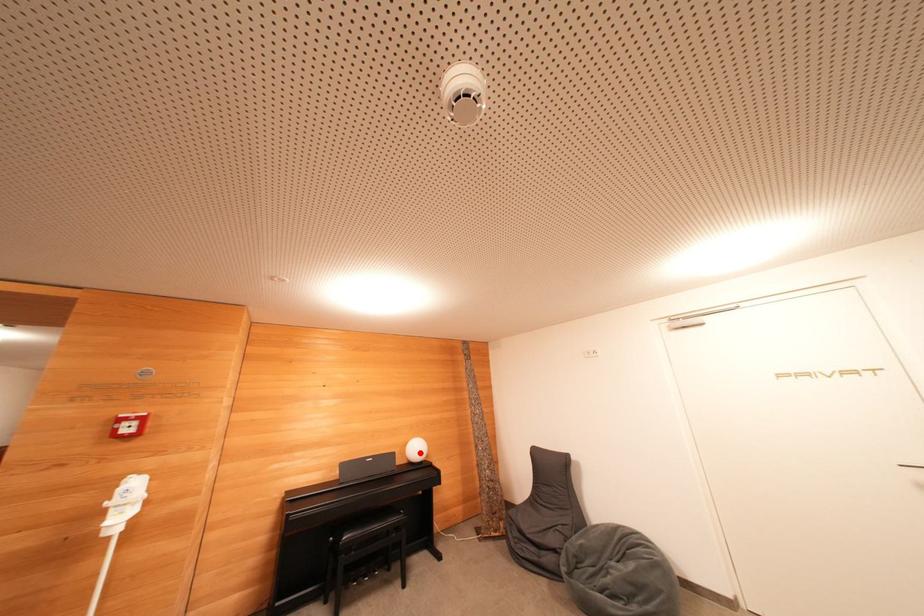
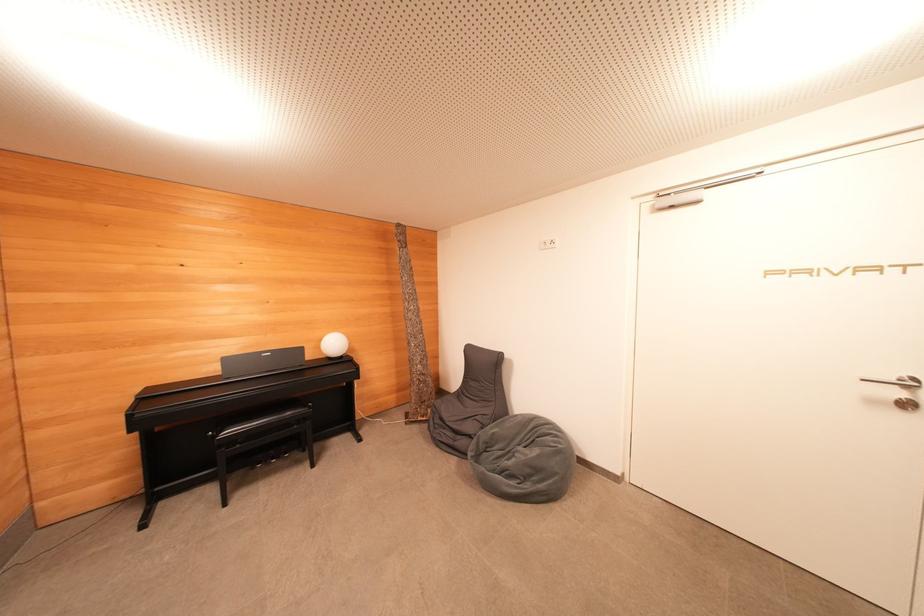
Where in the second image is the point corresponding to the highlighted location from the first image?

(337, 347)